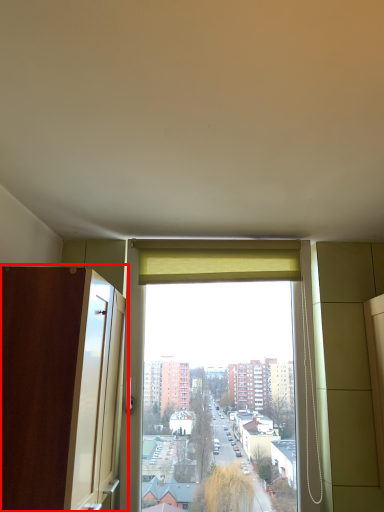
Question: From the image's perspective, where is screen door (annotated by the red box) located in relation to curtain in the image?

Choices:
 (A) above
 (B) below

Answer: (B)